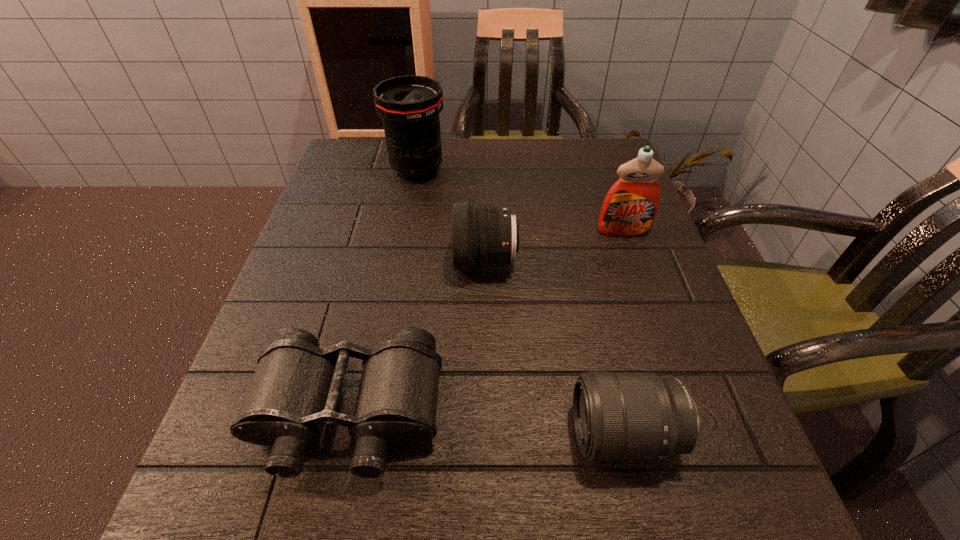
This screenshot has width=960, height=540. In order to click on the farthest object in this screenshot , I will do `click(409, 106)`.

Where is `the farthest telephoto lens`? This screenshot has height=540, width=960. the farthest telephoto lens is located at coordinates (409, 106).

Locate an element on the screen. The width and height of the screenshot is (960, 540). the fourth nearest object is located at coordinates (629, 209).

I want to click on the second farthest telephoto lens, so click(483, 236).

You are a GUI agent. You are given a task and a screenshot of the screen. Output one action in this format:
    pyautogui.click(x=<x>, y=<y>)
    Task: Click on the second telephoto lens from right to left
    
    Given the screenshot: What is the action you would take?
    pyautogui.click(x=483, y=236)

Find the location of a particular element. This screenshot has width=960, height=540. the nearest telephoto lens is located at coordinates (618, 416).

The width and height of the screenshot is (960, 540). In order to click on binoculars in this screenshot , I will do [x=295, y=389].

You are a GUI agent. You are given a task and a screenshot of the screen. Output one action in this format:
    pyautogui.click(x=<x>, y=<y>)
    Task: Click on the blank space located on the left of the tallest telephoto lens
    The width and height of the screenshot is (960, 540).
    Given the screenshot: What is the action you would take?
    pyautogui.click(x=348, y=171)

The width and height of the screenshot is (960, 540). I want to click on free space located on the front surface of the fourth nearest object, so click(678, 387).

In order to click on vacant space located at the front element of the third object from right to left in this screenshot , I will do `click(308, 262)`.